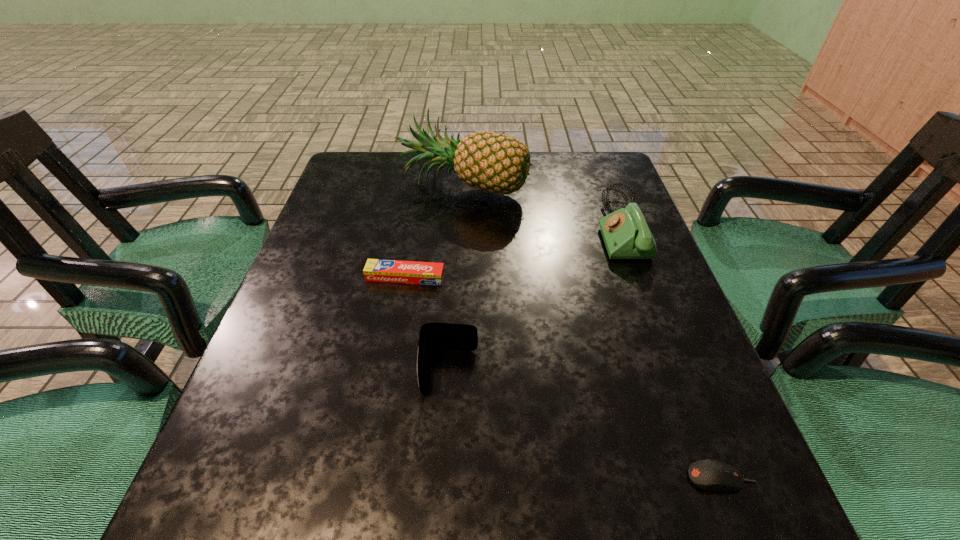
At what (x,y) coordinates should I click in order to perform the action: click on vacant point located between the toothpaste and the pineapple. Please return your answer as a coordinate pair (x, y). This screenshot has width=960, height=540. Looking at the image, I should click on (435, 231).

The image size is (960, 540). In order to click on free space between the wallet and the tallest object in this screenshot , I will do `click(456, 278)`.

Locate an element on the screen. empty space that is in between the fourth farthest object and the tallest object is located at coordinates (456, 278).

At what (x,y) coordinates should I click in order to perform the action: click on empty space that is in between the pineapple and the telephone. Please return your answer as a coordinate pair (x, y). Looking at the image, I should click on (541, 205).

I want to click on blank region between the telephone and the fourth farthest object, so click(x=535, y=299).

Image resolution: width=960 pixels, height=540 pixels. What are the coordinates of `vacant point located between the computer mouse and the tallest object` in the screenshot? It's located at (592, 331).

Select which object is the third closest to the toothpaste. Please provide its 2D coordinates. Your answer should be formatted as a tuple, i.e. [(x, y)], where the tuple contains the x and y coordinates of a point satisfying the conditions above.

[(626, 235)]

Identify which object is located as the second nearest to the third farthest object. Please provide its 2D coordinates. Your answer should be formatted as a tuple, i.e. [(x, y)], where the tuple contains the x and y coordinates of a point satisfying the conditions above.

[(492, 162)]

At what (x,y) coordinates should I click in order to perform the action: click on vacant space that satisfies the following two spatial constraints: 1. on the back side of the pineapple; 2. on the left side of the third nearest object. Please return your answer as a coordinate pair (x, y). Image resolution: width=960 pixels, height=540 pixels. Looking at the image, I should click on (421, 185).

Find the location of `free location that satisfies the following two spatial constraints: 1. on the dial of the nearest object; 2. on the left side of the telephone`. free location that satisfies the following two spatial constraints: 1. on the dial of the nearest object; 2. on the left side of the telephone is located at coordinates (714, 477).